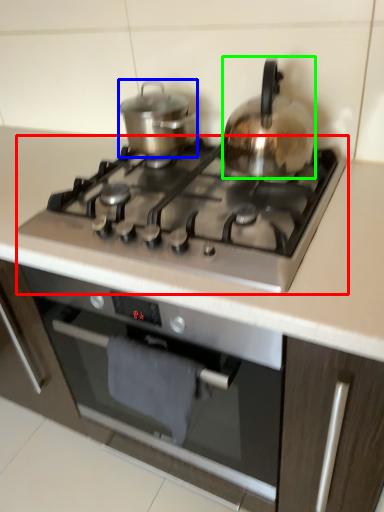
Question: Which object is positioned closest to gas stove (highlighted by a red box)? Select from kitchen appliance (highlighted by a blue box) and kitchen appliance (highlighted by a green box).

Choices:
 (A) kitchen appliance
 (B) kitchen appliance

Answer: (B)